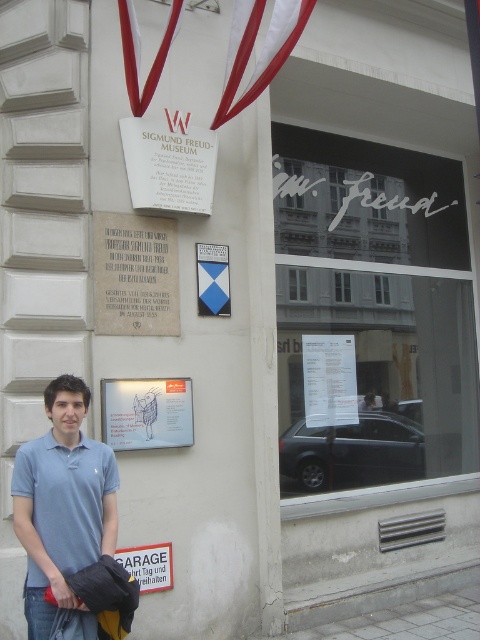
You are a tour guide standing in front of the Sigmund Freud Museum. You notice a light blue polo shirt at lower left and a white stone plaque at upper center. Which object is closer to you?

The light blue polo shirt at lower left is closer to you because it is at lower left compared to the white stone plaque at upper center, which is positioned higher up.